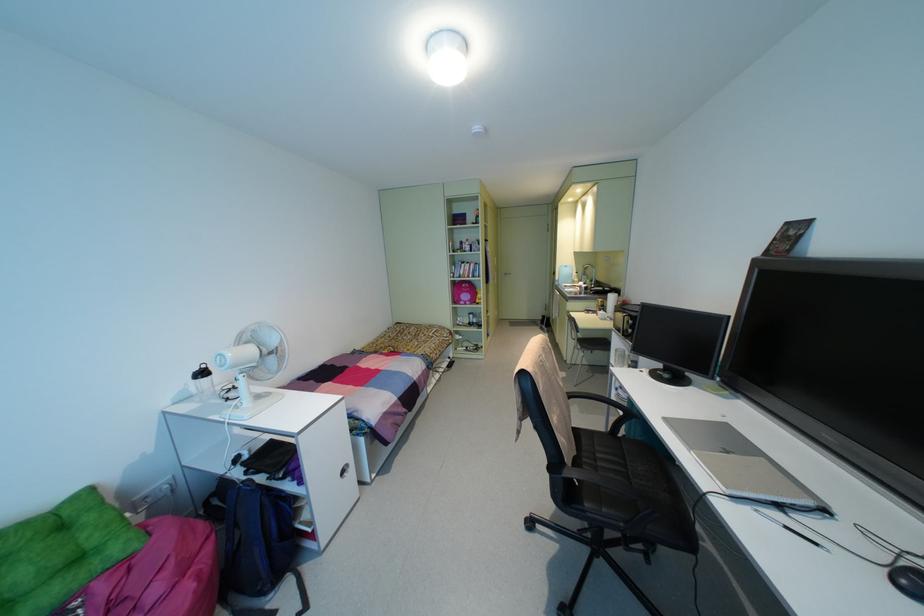
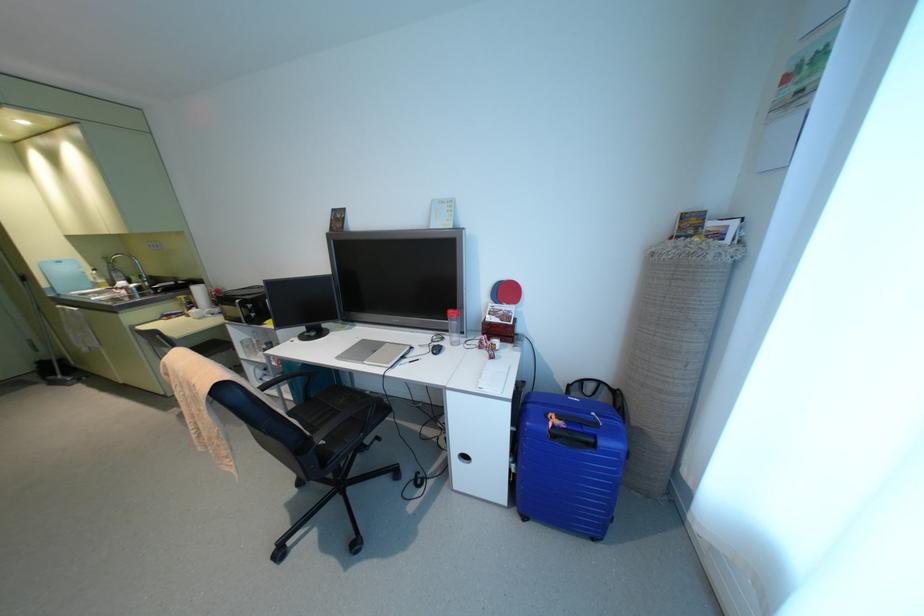
Find the pixel in the second image that matches point (809, 503) in the first image.

(407, 347)